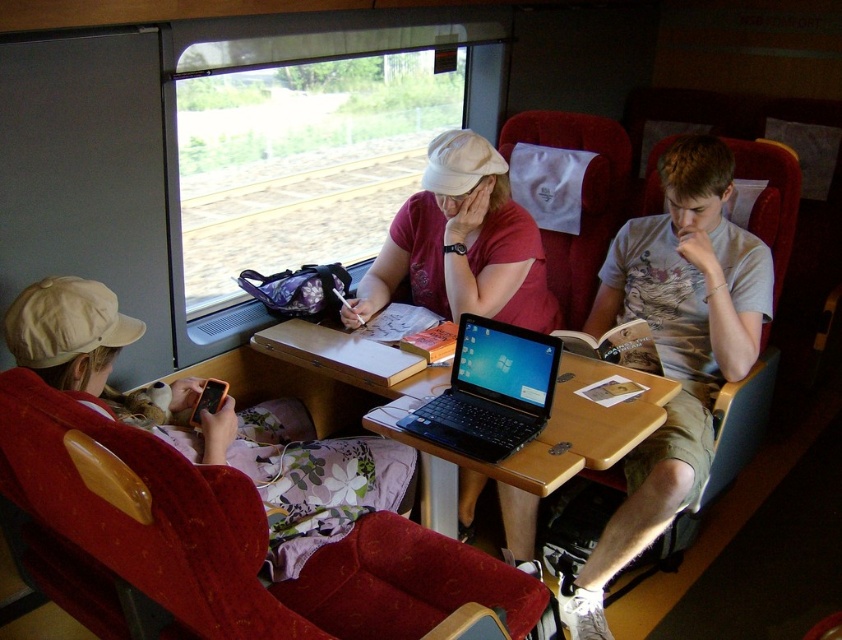
Question: Which point is closer to the camera?

Choices:
 (A) (475, 452)
 (B) (534, 435)
 (C) (624, 289)

Answer: (A)

Question: Does matte pink shirt at center appear on the right side of wooden at center?

Choices:
 (A) yes
 (B) no

Answer: (A)

Question: Which object is farther from the camera taking this photo?

Choices:
 (A) black plastic laptop at center
 (B) matte pink shirt at center

Answer: (B)

Question: Which is nearer to the matte pink shirt at center?

Choices:
 (A) light gray cotton t-shirt at center
 (B) black plastic laptop at center
 (C) wooden at center

Answer: (C)

Question: Does light gray cotton t-shirt at center lie behind matte pink shirt at center?

Choices:
 (A) no
 (B) yes

Answer: (A)

Question: Does wooden at center have a greater width compared to black plastic laptop at center?

Choices:
 (A) yes
 (B) no

Answer: (A)